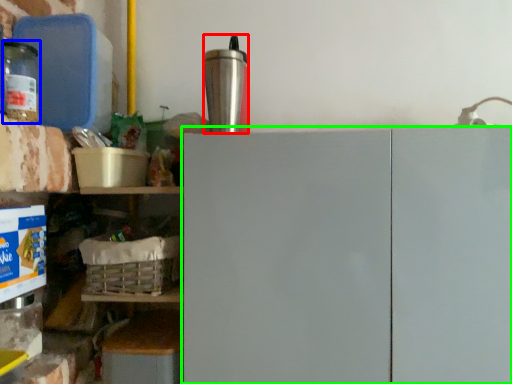
Question: Based on their relative distances, which object is farther from appliance (highlighted by a red box)? Choose from bottle (highlighted by a blue box) and cabinetry (highlighted by a green box).

Choices:
 (A) bottle
 (B) cabinetry

Answer: (A)